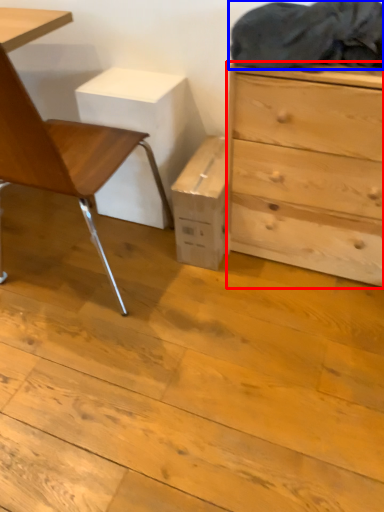
Question: Which point is closer to the camera, chest of drawers (highlighted by a red box) or laundry (highlighted by a blue box)?

Choices:
 (A) chest of drawers
 (B) laundry

Answer: (B)